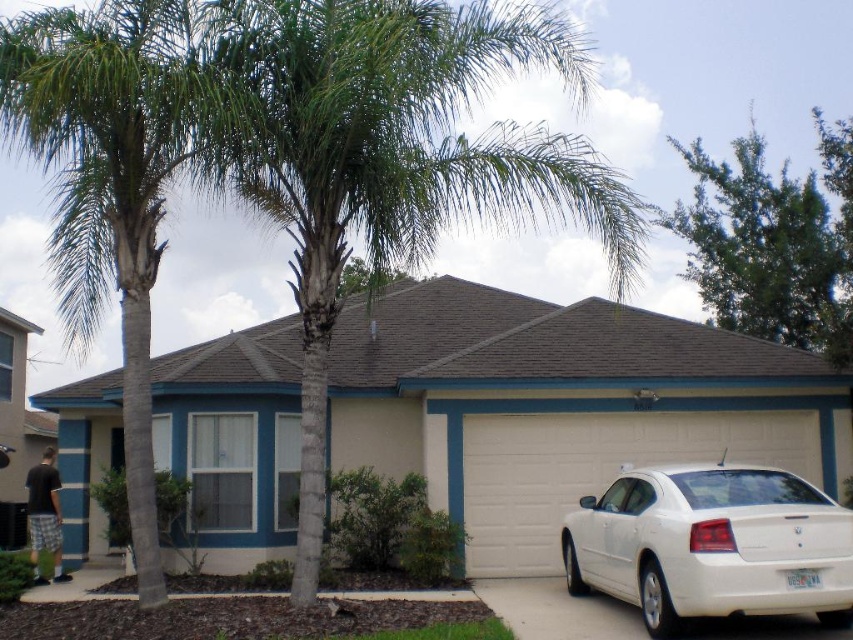
You are standing at the front door of the house and want to get to your car, the white glossy sedan at lower right. There is a green leafy tree at upper right above your car. Will you have to walk under the tree to reach your car?

The white glossy sedan at lower right is below the green leafy tree at upper right, so yes, you will have to walk under the green leafy tree at upper right to reach the white glossy sedan at lower right.

You are a drone operator tasked with capturing aerial footage of the house. The drone has a maximum flight range of 10 meters. If you position the drone above the green leafy palm tree at left, can it reach the green leafy tree at upper right without exceeding its range?

The green leafy palm tree at left is 12.88 meters from the green leafy tree at upper right. Since the drone has a maximum flight range of 10 meters, it cannot reach the green leafy tree at upper right without exceeding its range.